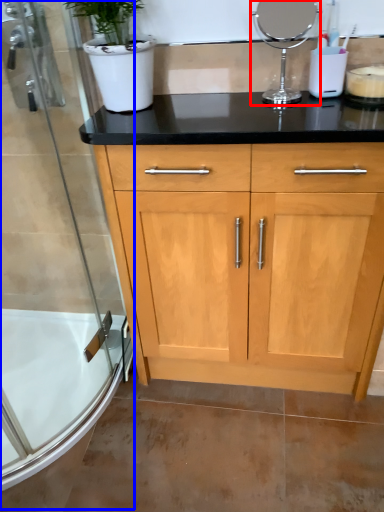
Question: Which object appears closest to the camera in this image, appliance (highlighted by a red box) or shower door (highlighted by a blue box)?

Choices:
 (A) appliance
 (B) shower door

Answer: (B)